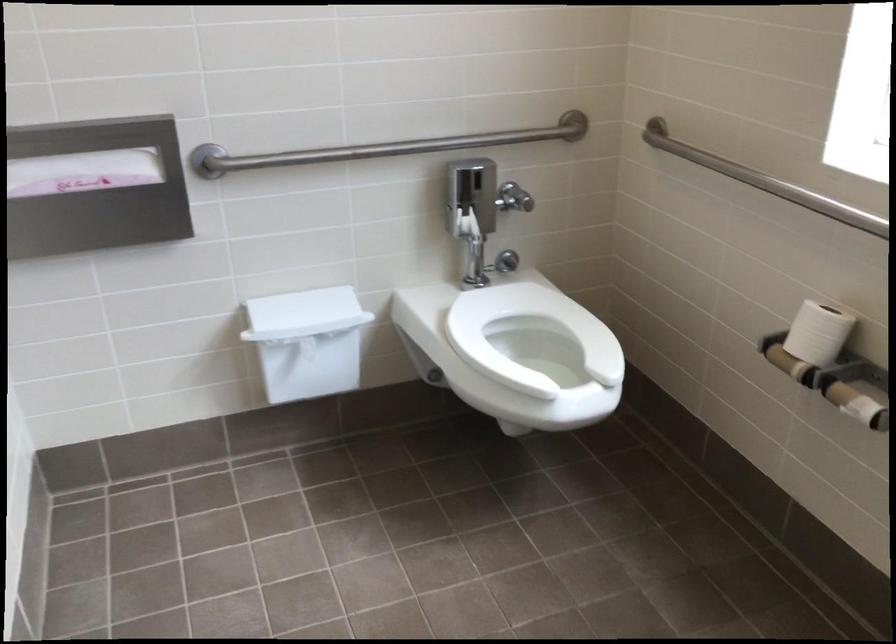
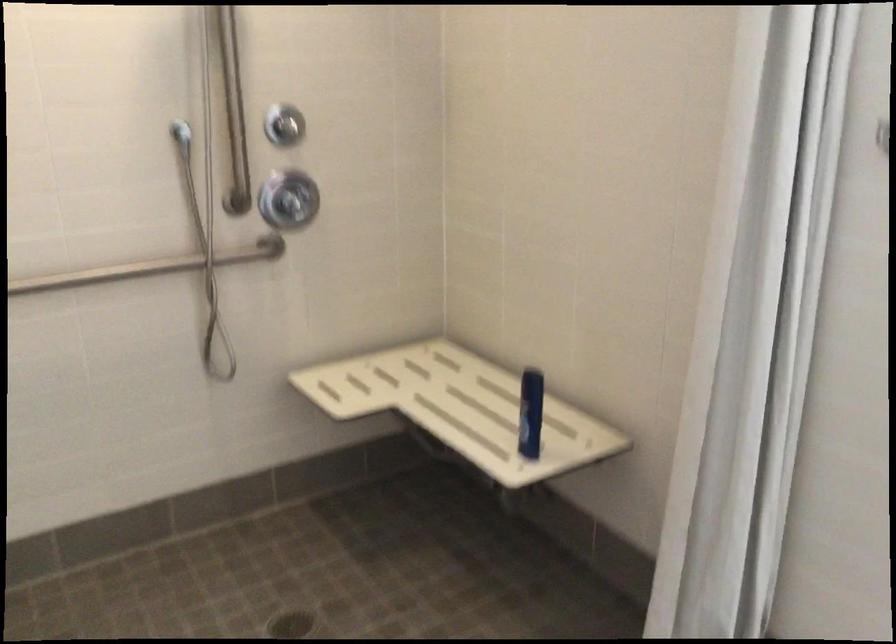
Question: I am providing you with two images of the same scene from different viewpoints. Please identify which objects are invisible in image2.

Choices:
 (A) white bin lid
 (B) handheld shower head
 (C) bag zipper pull
 (D) chrome shower knob

Answer: (A)